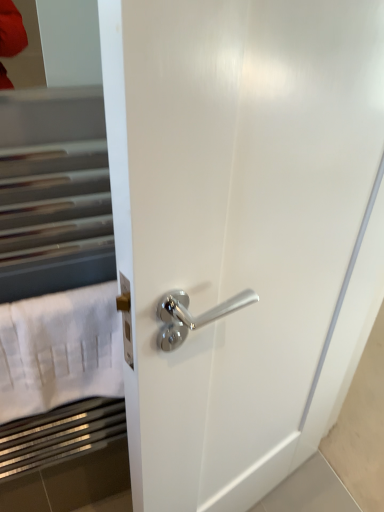
Locate an element on the screen. This screenshot has width=384, height=512. white fabric at left is located at coordinates (59, 350).

Describe the element at coordinates (59, 350) in the screenshot. I see `white fabric at left` at that location.

At what (x,y) coordinates should I click in order to perform the action: click on white fabric at left. Please return your answer as a coordinate pair (x, y). This screenshot has height=512, width=384. Looking at the image, I should click on (59, 350).